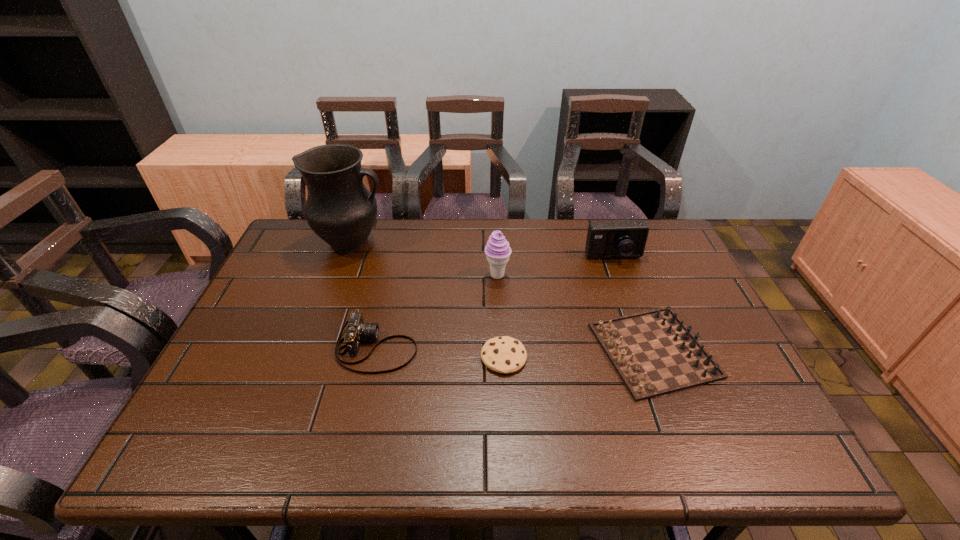
The width and height of the screenshot is (960, 540). What are the coordinates of `free space located on the left of the icecream` in the screenshot? It's located at (404, 275).

Where is `vacant space positioned 0.310m on the front-facing side of the third tallest object`? This screenshot has width=960, height=540. vacant space positioned 0.310m on the front-facing side of the third tallest object is located at coordinates (645, 343).

At what (x,y) coordinates should I click in order to perform the action: click on free spot located 0.260m on the front-facing side of the shorter camera. Please return your answer as a coordinate pair (x, y). The width and height of the screenshot is (960, 540). Looking at the image, I should click on (521, 347).

You are a GUI agent. You are given a task and a screenshot of the screen. Output one action in this format:
    pyautogui.click(x=<x>, y=<y>)
    Task: Click on the free location located 0.120m on the front of the chessboard
    
    Given the screenshot: What is the action you would take?
    pyautogui.click(x=692, y=453)

Locate an element on the screen. The width and height of the screenshot is (960, 540). vacant space located on the back of the cookie is located at coordinates (501, 296).

I want to click on pitcher located in the far edge section of the desktop, so click(339, 209).

You are a GUI agent. You are given a task and a screenshot of the screen. Output one action in this format:
    pyautogui.click(x=<x>, y=<y>)
    Task: Click on the camera at the far edge
    This screenshot has width=960, height=540.
    Given the screenshot: What is the action you would take?
    pyautogui.click(x=621, y=239)

The image size is (960, 540). Identify the location of object that is at the left edge. (339, 209).

Identify the location of camera located in the right edge section of the desktop. (621, 239).

I want to click on chessboard at the right edge, so click(654, 353).